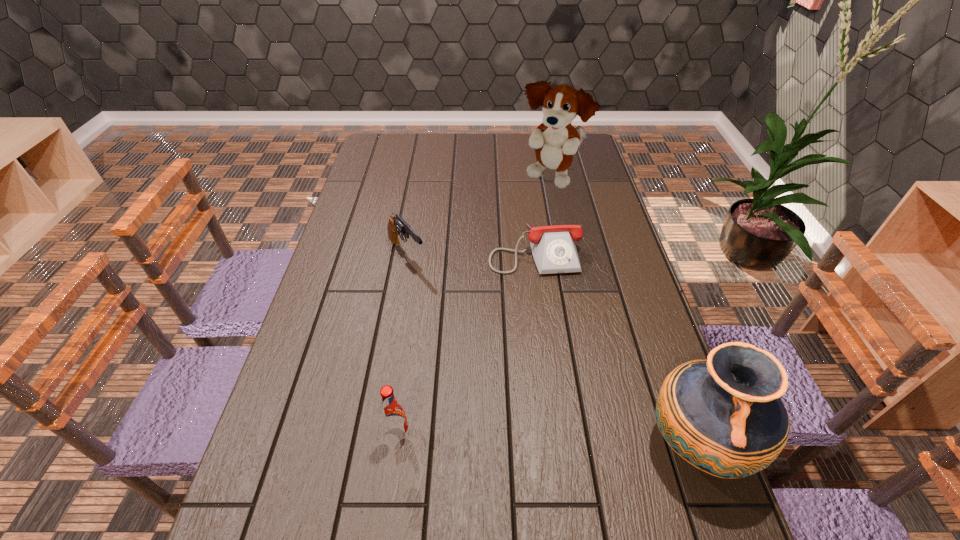
The image size is (960, 540). I want to click on vacant space on the desktop that is between the root beer and the pottery and is positioned on the dial of the telephone, so click(582, 441).

Where is `free space on the desktop that is between the third shortest object and the second tallest object and is positioned along the barrel of the gun`? free space on the desktop that is between the third shortest object and the second tallest object and is positioned along the barrel of the gun is located at coordinates (577, 441).

Image resolution: width=960 pixels, height=540 pixels. What are the coordinates of `vacant space on the desktop that is between the third shortest object and the second tallest object and is positioned on the face of the puppy` in the screenshot? It's located at (503, 438).